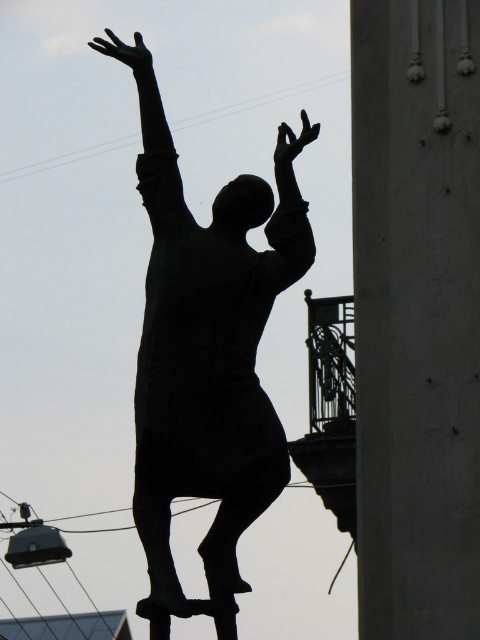
Question: Which point appears closest to the camera in this image?

Choices:
 (A) (107, 29)
 (B) (184, 241)

Answer: (B)

Question: Which point is closer to the camera?

Choices:
 (A) (267, 307)
 (B) (81, 157)
 (C) (294, 196)
 (D) (471, 381)

Answer: (D)

Question: Can you confirm if black matte statue at center is positioned to the left of black matte arm at upper center?

Choices:
 (A) yes
 (B) no

Answer: (B)

Question: Can you confirm if black matte statue at center is positioned above black wire at upper center?

Choices:
 (A) no
 (B) yes

Answer: (A)

Question: Is smooth concrete pillar at right wider than black wire at upper center?

Choices:
 (A) yes
 (B) no

Answer: (B)

Question: Which object is farther from the camera taking this photo?

Choices:
 (A) black wire at upper center
 (B) black matte statue at center
 (C) black matte arm at center

Answer: (A)